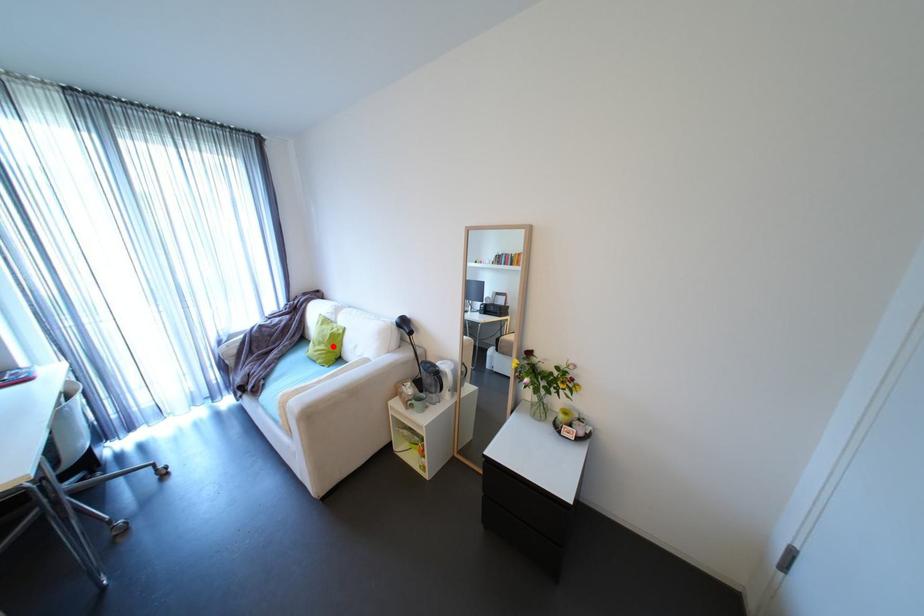
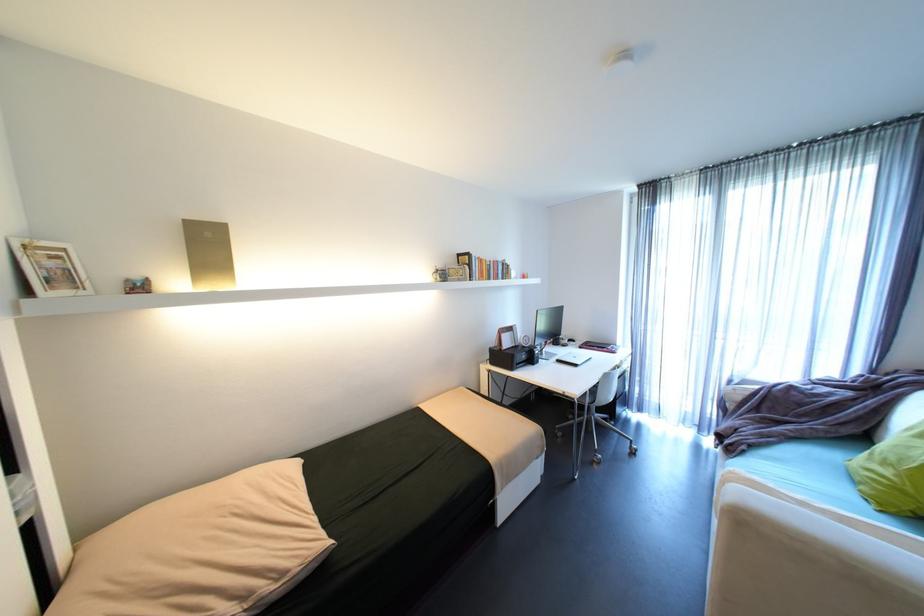
In the second image, find the point that corresponds to the highlighted location in the first image.

(906, 476)